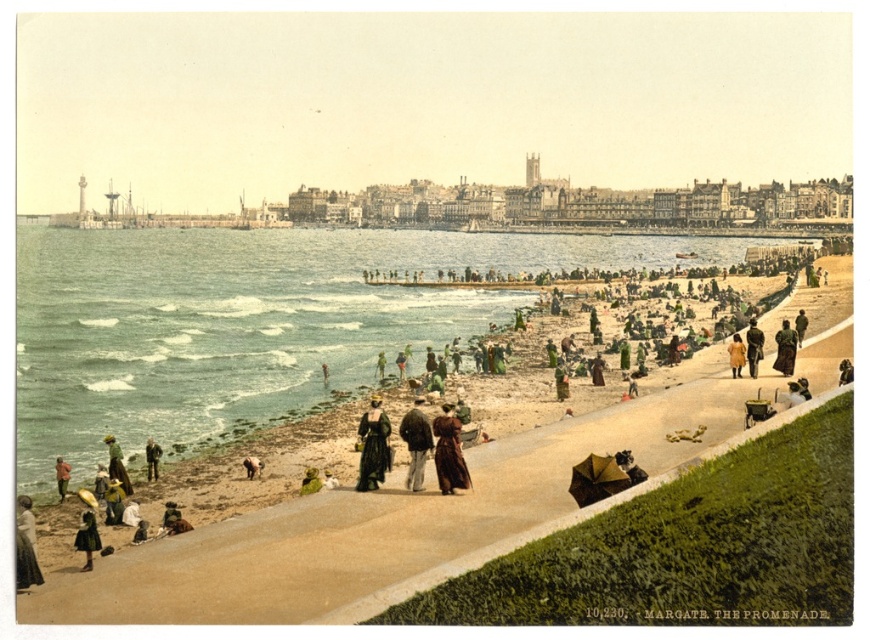
Question: Does matte black dress at lower left come behind brown wool coat at lower right?

Choices:
 (A) no
 (B) yes

Answer: (A)

Question: Among these objects, which one is farthest from the camera?

Choices:
 (A) brown wool coat at lower right
 (B) matte black dress at lower left
 (C) green fabric dress at lower left

Answer: (A)

Question: Which point is farther to the camera?

Choices:
 (A) (429, 429)
 (B) (91, 525)
 (C) (737, 358)
 (D) (453, 417)

Answer: (C)

Question: Is the position of brown leather jacket at lower left more distant than that of green fabric umbrella at lower right?

Choices:
 (A) no
 (B) yes

Answer: (A)

Question: Is brown velvet coat at center bigger than dark brown leather coat at center?

Choices:
 (A) yes
 (B) no

Answer: (B)

Question: Which object is farther from the camera taking this photo?

Choices:
 (A) brown wool coat at right
 (B) dark brown leather coat at center

Answer: (A)